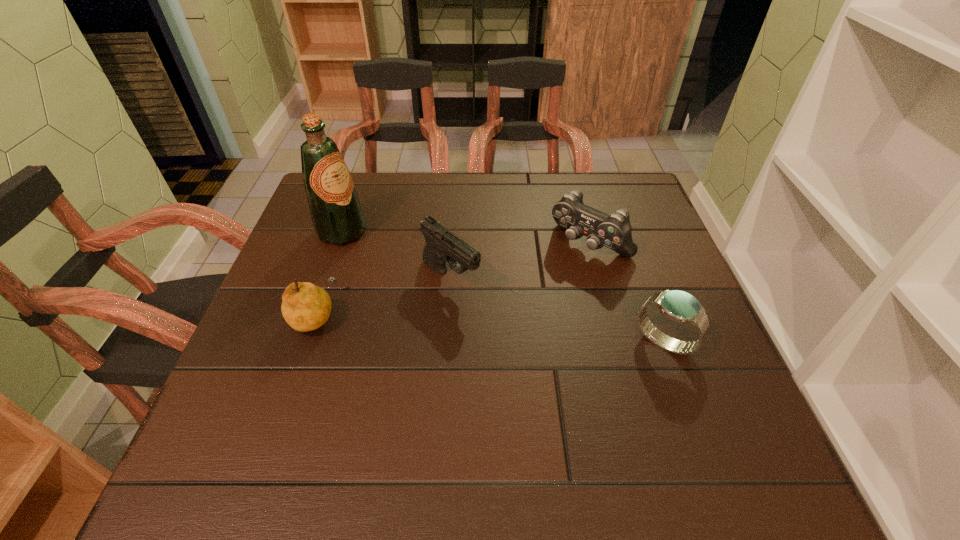
At what (x,y) coordinates should I click in order to perform the action: click on pear. Please return your answer as a coordinate pair (x, y). Looking at the image, I should click on (305, 307).

Where is `watch`? The width and height of the screenshot is (960, 540). watch is located at coordinates (679, 306).

Find the location of a particular element. The height and width of the screenshot is (540, 960). the tallest object is located at coordinates (337, 216).

You are a GUI agent. You are given a task and a screenshot of the screen. Output one action in this format:
    pyautogui.click(x=<x>, y=<y>)
    Task: Click on the control
    
    Given the screenshot: What is the action you would take?
    pyautogui.click(x=614, y=231)

Find the location of a particular element. the third object from right to left is located at coordinates (442, 246).

I want to click on vacant space situated 0.080m on the back of the pear, so click(331, 269).

This screenshot has width=960, height=540. In order to click on vacant space located 0.240m on the back of the watch in this screenshot , I will do `click(629, 247)`.

Where is `free spot located on the front-facing side of the olive oil`? free spot located on the front-facing side of the olive oil is located at coordinates (411, 271).

Find the location of a particular element. The image size is (960, 540). free location located on the front-facing side of the olive oil is located at coordinates (396, 262).

Where is `free region located on the front-facing side of the olive oil`? The height and width of the screenshot is (540, 960). free region located on the front-facing side of the olive oil is located at coordinates (440, 287).